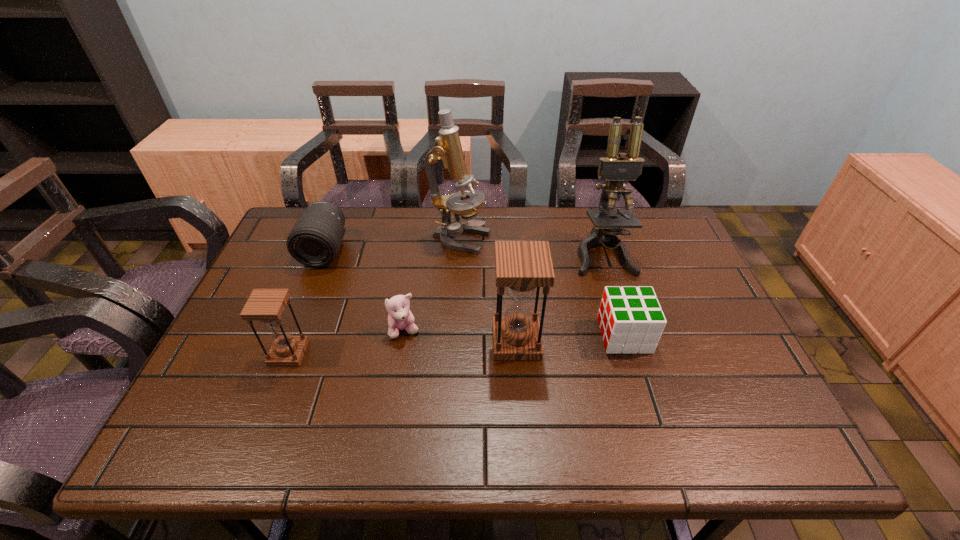
Where is `vacant space located on the back of the taller hourglass`? The width and height of the screenshot is (960, 540). vacant space located on the back of the taller hourglass is located at coordinates (511, 265).

The image size is (960, 540). I want to click on blank area located 0.340m on the surface of the third shortest object, so click(x=277, y=367).

Identify the location of vacant space positioned 0.130m at the eyepieces of the right microscope. click(620, 310).

Where is `free location located 0.140m on the right of the left microscope`? This screenshot has height=540, width=960. free location located 0.140m on the right of the left microscope is located at coordinates (535, 241).

Identify the location of vacant position located on the red face of the cube. (485, 335).

Locate an element on the screen. vacant point located on the red face of the cube is located at coordinates 549,335.

Where is `vacant space situated on the red face of the cube`? The width and height of the screenshot is (960, 540). vacant space situated on the red face of the cube is located at coordinates (509, 335).

You are a GUI agent. You are given a task and a screenshot of the screen. Output one action in this format:
    pyautogui.click(x=<x>, y=<y>)
    Task: Click on the free space located 0.150m at the face of the teddy bear
    
    Given the screenshot: What is the action you would take?
    pyautogui.click(x=395, y=395)

Image resolution: width=960 pixels, height=540 pixels. In order to click on telephoto lens located in the far edge section of the desktop in this screenshot , I will do `click(314, 241)`.

You are a GUI agent. You are given a task and a screenshot of the screen. Output one action in this format:
    pyautogui.click(x=<x>, y=<y>)
    Task: Click on the hourglass at the left edge
    This screenshot has width=960, height=540.
    Given the screenshot: What is the action you would take?
    pyautogui.click(x=266, y=305)